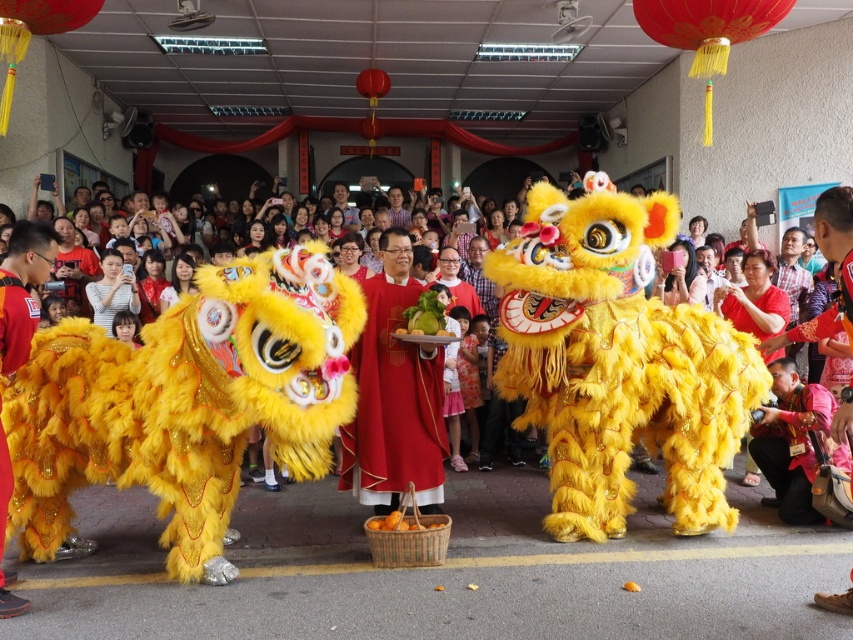
Between silky red robe at center and velvet yellow lion costume at center, which one appears on the right side from the viewer's perspective?

Positioned to the right is silky red robe at center.

Is point (392, 502) more distant than point (16, 348)?

Yes, it is behind point (16, 348).

Image resolution: width=853 pixels, height=640 pixels. In order to click on silky red robe at center in this screenshot , I will do `click(393, 404)`.